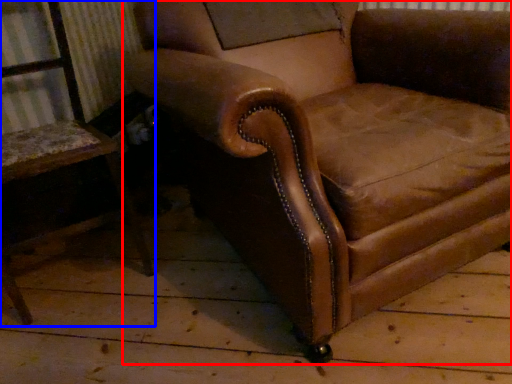
Question: Among these objects, which one is farthest to the camera, chair (highlighted by a red box) or chair (highlighted by a blue box)?

Choices:
 (A) chair
 (B) chair

Answer: (B)